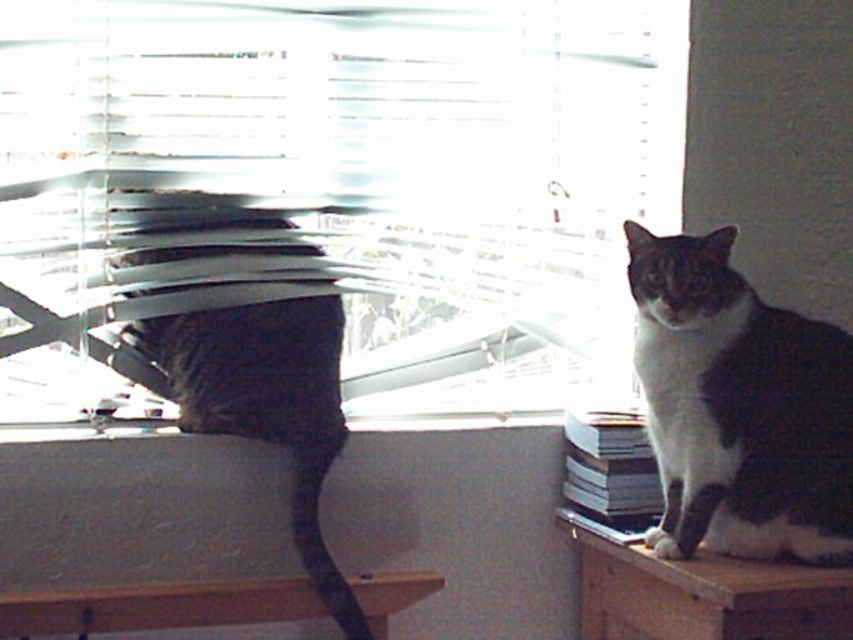
You are a cat owner who wants to place a small cat tree on the wooden table at right without blocking the sunlight coming through the white plastic blinds at upper center. Is this possible?

The white plastic blinds at upper center are positioned over the wooden table at right, so placing a small cat tree on the wooden table at right would not block the sunlight coming through the white plastic blinds at upper center as they are above the table.

You are a small toy mouse that is 10 cm tall. You want to play with both the wooden table at right and the wooden table at lower left. Which table can you climb onto without needing to jump?

The wooden table at right is much taller than the wooden table at lower left, so the toy mouse can climb onto the wooden table at lower left without needing to jump since it is shorter.

You are trying to decide which object in the scene is bigger between the white plastic blinds at upper center and the wooden table at lower left. Based on the scene description, which one is larger?

The white plastic blinds at upper center has a larger size compared to wooden table at lower left, so the white plastic blinds at upper center is bigger.